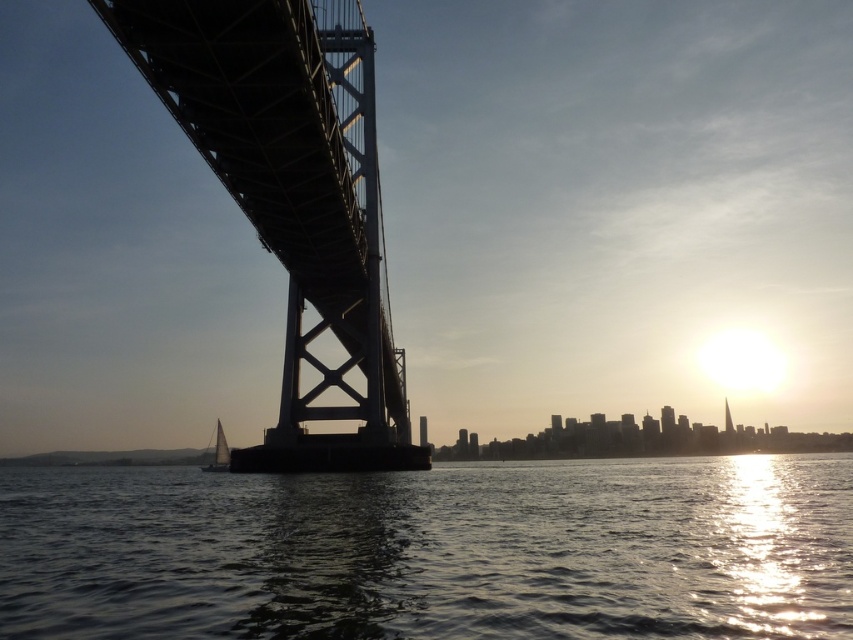
Is shiny dark water at center closer to the viewer compared to white sailboat at lower left?

Yes, shiny dark water at center is in front of white sailboat at lower left.

Looking at this image, does shiny dark water at center have a larger size compared to white sailboat at lower left?

Yes.

I want to click on shiny dark water at center, so click(x=432, y=552).

Can you confirm if silhouette steel bridge at left is positioned below white sailboat at lower left?

Actually, silhouette steel bridge at left is above white sailboat at lower left.

Is silhouette steel bridge at left to the right of white sailboat at lower left from the viewer's perspective?

Indeed, silhouette steel bridge at left is positioned on the right side of white sailboat at lower left.

Image resolution: width=853 pixels, height=640 pixels. What do you see at coordinates (293, 196) in the screenshot? I see `silhouette steel bridge at left` at bounding box center [293, 196].

Identify the location of silhouette steel bridge at left. The image size is (853, 640). (293, 196).

Which is behind, point (112, 525) or point (303, 166)?

Point (303, 166)

Is point (161, 609) positioned before point (397, 440)?

Yes, it is in front of point (397, 440).

Is point (535, 467) positioned behind point (305, 97)?

Yes, point (535, 467) is behind point (305, 97).

You are a GUI agent. You are given a task and a screenshot of the screen. Output one action in this format:
    pyautogui.click(x=<x>, y=<y>)
    Task: Click on the shiny dark water at center
    The width and height of the screenshot is (853, 640).
    Given the screenshot: What is the action you would take?
    pos(432,552)